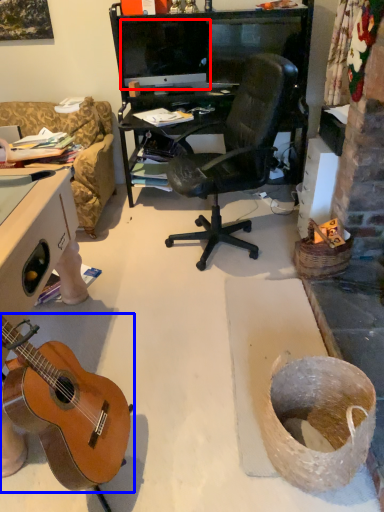
Question: Which object appears closest to the camera in this image, computer monitor (highlighted by a red box) or guitar (highlighted by a blue box)?

Choices:
 (A) computer monitor
 (B) guitar

Answer: (B)